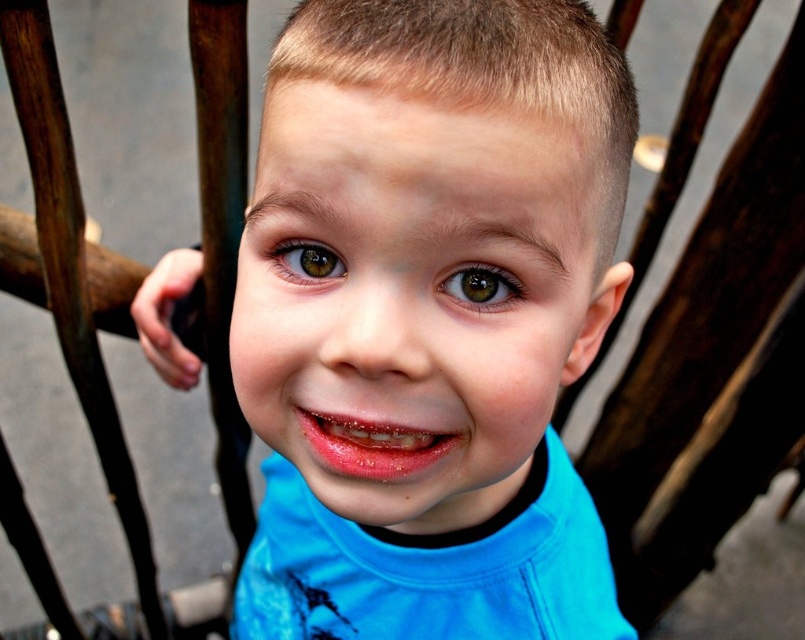
Question: Is blue fabric shirt at center bigger than brown glossy eye at center?

Choices:
 (A) no
 (B) yes

Answer: (B)

Question: Is wooden chair at center to the left of brown glossy eye at center from the viewer's perspective?

Choices:
 (A) yes
 (B) no

Answer: (A)

Question: Which object appears farthest from the camera in this image?

Choices:
 (A) shiny pink lips at center
 (B) blue fabric shirt at center

Answer: (A)

Question: Considering the real-world distances, which object is farthest from the blue fabric shirt at center?

Choices:
 (A) wooden chair at center
 (B) green matte eye at center

Answer: (A)

Question: Can you confirm if wooden chair at center is wider than green matte eye at center?

Choices:
 (A) no
 (B) yes

Answer: (B)

Question: Which of the following is the closest to the observer?

Choices:
 (A) green matte eye at center
 (B) wooden chair at center
 (C) blue fabric shirt at center

Answer: (C)